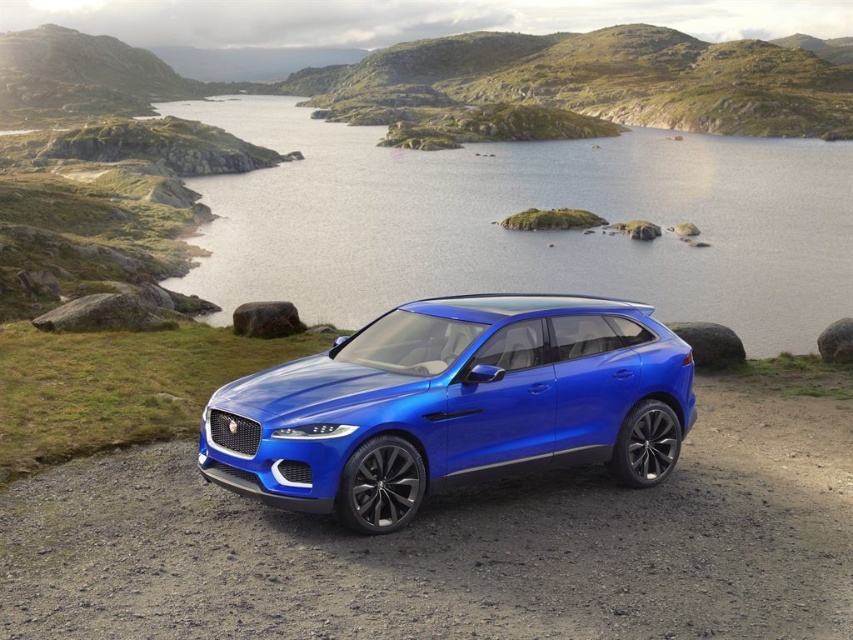
Question: Does glossy blue water at center come behind shiny metallic blue suv at center?

Choices:
 (A) no
 (B) yes

Answer: (B)

Question: Among these objects, which one is farthest from the camera?

Choices:
 (A) shiny metallic blue suv at center
 (B) glossy blue water at center

Answer: (B)

Question: Observing the image, what is the correct spatial positioning of glossy blue water at center in reference to shiny metallic blue suv at center?

Choices:
 (A) below
 (B) above

Answer: (B)

Question: Which object appears farthest from the camera in this image?

Choices:
 (A) shiny metallic blue suv at center
 (B) glossy blue water at center

Answer: (B)

Question: Is glossy blue water at center thinner than shiny metallic blue suv at center?

Choices:
 (A) yes
 (B) no

Answer: (B)